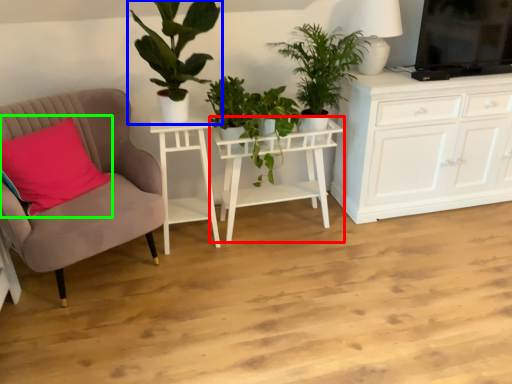
Question: Which object is positioned farthest from table (highlighted by a red box)? Select from houseplant (highlighted by a blue box) and pillow (highlighted by a green box).

Choices:
 (A) houseplant
 (B) pillow

Answer: (B)